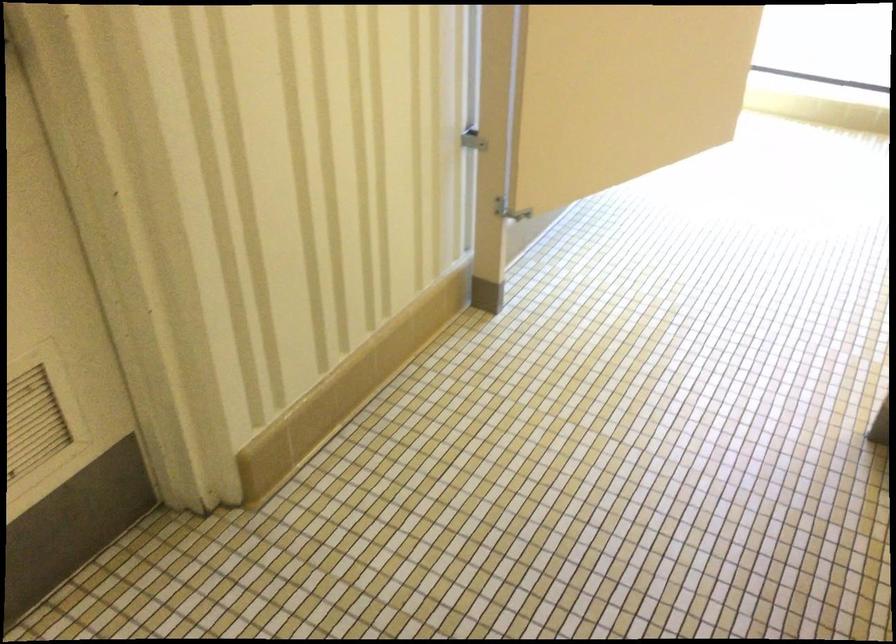
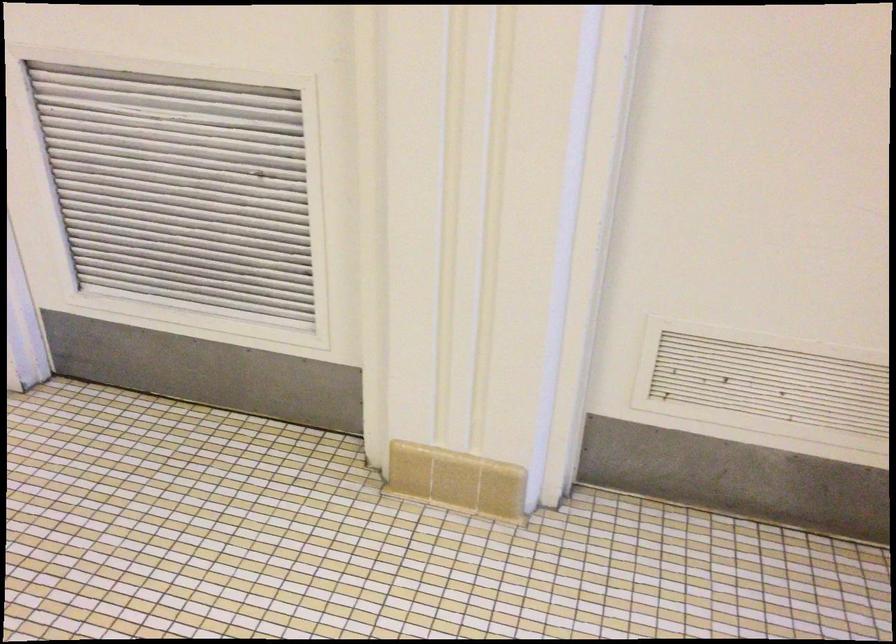
Question: How did the camera likely rotate?

Choices:
 (A) Left
 (B) Right
 (C) Up
 (D) Down

Answer: (A)